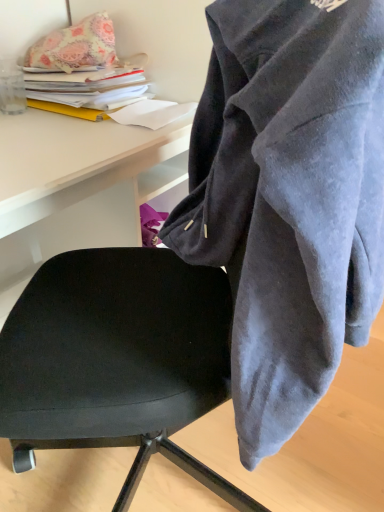
Question: Does floral fabric pillow at upper left have a smaller size compared to velvet gray hoodie at center?

Choices:
 (A) yes
 (B) no

Answer: (A)

Question: Could you tell me if floral fabric pillow at upper left is turned towards velvet gray hoodie at center?

Choices:
 (A) no
 (B) yes

Answer: (B)

Question: Is floral fabric pillow at upper left bigger than velvet gray hoodie at center?

Choices:
 (A) yes
 (B) no

Answer: (B)

Question: From the image's perspective, is floral fabric pillow at upper left beneath velvet gray hoodie at center?

Choices:
 (A) no
 (B) yes

Answer: (A)

Question: Is floral fabric pillow at upper left with velvet gray hoodie at center?

Choices:
 (A) no
 (B) yes

Answer: (A)

Question: Does floral fabric pillow at upper left have a lesser height compared to velvet gray hoodie at center?

Choices:
 (A) yes
 (B) no

Answer: (A)

Question: Considering the relative positions of black leather chair at center and velvet gray hoodie at center in the image provided, is black leather chair at center to the left of velvet gray hoodie at center from the viewer's perspective?

Choices:
 (A) no
 (B) yes

Answer: (B)

Question: Is black leather chair at center facing towards velvet gray hoodie at center?

Choices:
 (A) yes
 (B) no

Answer: (A)

Question: Can you confirm if black leather chair at center is bigger than velvet gray hoodie at center?

Choices:
 (A) yes
 (B) no

Answer: (A)

Question: Does black leather chair at center have a greater width compared to velvet gray hoodie at center?

Choices:
 (A) yes
 (B) no

Answer: (A)

Question: From the image's perspective, does black leather chair at center appear lower than velvet gray hoodie at center?

Choices:
 (A) yes
 (B) no

Answer: (A)

Question: Is black leather chair at center thinner than velvet gray hoodie at center?

Choices:
 (A) yes
 (B) no

Answer: (B)

Question: From a real-world perspective, is black leather chair at center physically above floral fabric pillow at upper left?

Choices:
 (A) yes
 (B) no

Answer: (B)